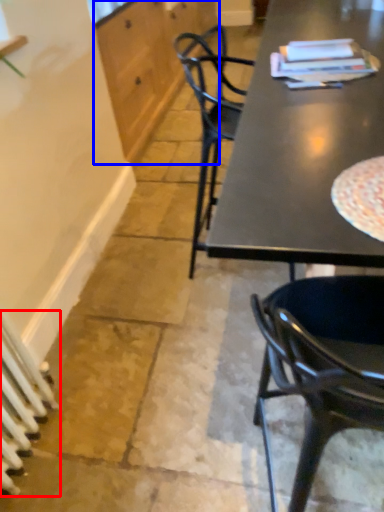
Question: Which object is further to the camera taking this photo, radiator (highlighted by a red box) or cabinetry (highlighted by a blue box)?

Choices:
 (A) radiator
 (B) cabinetry

Answer: (B)